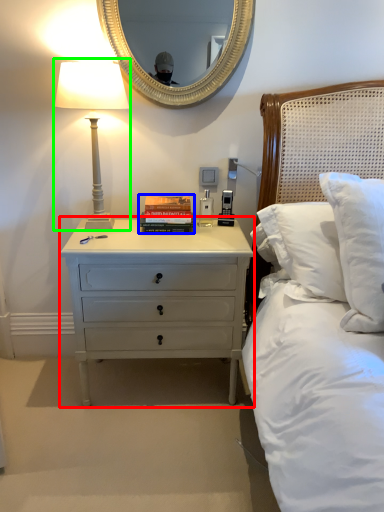
Question: Which object is the farthest from nightstand (highlighted by a red box)? Choose among these: paperback book (highlighted by a blue box) or bedside lamp (highlighted by a green box).

Choices:
 (A) paperback book
 (B) bedside lamp

Answer: (B)